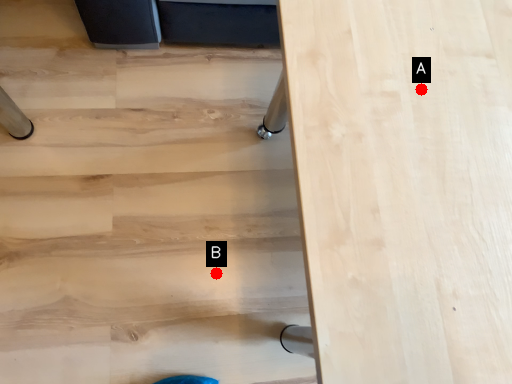
Question: Two points are circled on the image, labeled by A and B beside each circle. Which point is farther from the camera taking this photo?

Choices:
 (A) A is further
 (B) B is further

Answer: (B)